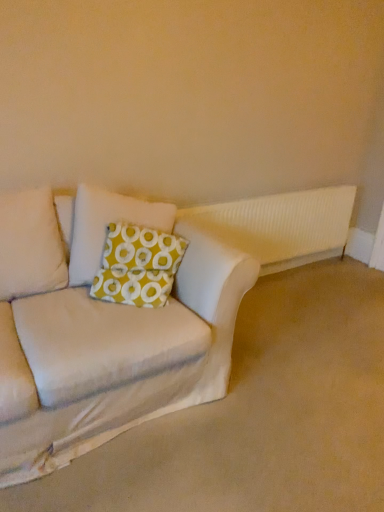
Identify the location of white ribbed radiator at upper right. (281, 225).

The height and width of the screenshot is (512, 384). What do you see at coordinates (106, 226) in the screenshot?
I see `yellowpatterned fabricpillow at center` at bounding box center [106, 226].

Describe the element at coordinates (103, 331) in the screenshot. I see `beige fabric couch at lower left` at that location.

Find the location of a particular element. The height and width of the screenshot is (512, 384). white ribbed radiator at upper right is located at coordinates (281, 225).

Is white ribbed radiator at upper right directly adjacent to green fabric pillow at center?

No, white ribbed radiator at upper right is not in contact with green fabric pillow at center.

Is white ribbed radiator at upper right surrounding green fabric pillow at center?

No.

Could you tell me if white ribbed radiator at upper right is turned towards green fabric pillow at center?

No, white ribbed radiator at upper right does not turn towards green fabric pillow at center.

Considering the sizes of objects white ribbed radiator at upper right and beige fabric couch at lower left in the image provided, who is shorter, white ribbed radiator at upper right or beige fabric couch at lower left?

With less height is beige fabric couch at lower left.

Is white ribbed radiator at upper right wider than beige fabric couch at lower left?

No, white ribbed radiator at upper right is not wider than beige fabric couch at lower left.

From a real-world perspective, is white ribbed radiator at upper right above or below beige fabric couch at lower left?

white ribbed radiator at upper right is above beige fabric couch at lower left.

Is white ribbed radiator at upper right facing away from beige fabric couch at lower left?

No, white ribbed radiator at upper right is not facing away from beige fabric couch at lower left.

Is the position of beige fabric couch at lower left more distant than that of white ribbed radiator at upper right?

No, it is in front of white ribbed radiator at upper right.

Could you tell me if beige fabric couch at lower left is turned towards white ribbed radiator at upper right?

No, beige fabric couch at lower left is not oriented towards white ribbed radiator at upper right.

From a real-world perspective, which object stands above the other?

white ribbed radiator at upper right is physically above.

Does beige fabric couch at lower left touch white ribbed radiator at upper right?

No, beige fabric couch at lower left is not beside white ribbed radiator at upper right.

Does green fabric pillow at center have a larger size compared to white ribbed radiator at upper right?

Actually, green fabric pillow at center might be smaller than white ribbed radiator at upper right.

Considering the sizes of green fabric pillow at center and white ribbed radiator at upper right in the image, is green fabric pillow at center taller or shorter than white ribbed radiator at upper right?

Considering their sizes, green fabric pillow at center has less height than white ribbed radiator at upper right.

From a real-world perspective, is green fabric pillow at center above or below white ribbed radiator at upper right?

In terms of real-world spatial position, green fabric pillow at center is above white ribbed radiator at upper right.

The height and width of the screenshot is (512, 384). In order to click on throw pillow located in front of the white ribbed radiator at upper right in this screenshot , I will do `click(138, 266)`.

Based on the photo, between yellowpatterned fabricpillow at center and white ribbed radiator at upper right, which one has larger width?

Wider between the two is yellowpatterned fabricpillow at center.

Which of these two, yellowpatterned fabricpillow at center or white ribbed radiator at upper right, is smaller?

white ribbed radiator at upper right is smaller.

In the scene shown: From the image's perspective, who appears lower, yellowpatterned fabricpillow at center or white ribbed radiator at upper right?

From the image's view, yellowpatterned fabricpillow at center is below.

Between point (75, 300) and point (169, 216), which one is positioned behind?

The point (169, 216) is farther from the camera.

How many degrees apart are the facing directions of beige fabric couch at lower left and yellowpatterned fabricpillow at center?

The angle between the facing direction of beige fabric couch at lower left and the facing direction of yellowpatterned fabricpillow at center is 98.7 degrees.

Is beige fabric couch at lower left positioned far away from yellowpatterned fabricpillow at center?

No, there isn't a large distance between beige fabric couch at lower left and yellowpatterned fabricpillow at center.

Does yellowpatterned fabricpillow at center turn towards green fabric pillow at center?

Yes, yellowpatterned fabricpillow at center is facing green fabric pillow at center.

Considering the sizes of objects yellowpatterned fabricpillow at center and green fabric pillow at center in the image provided, who is thinner, yellowpatterned fabricpillow at center or green fabric pillow at center?

With smaller width is green fabric pillow at center.

Relative to green fabric pillow at center, is yellowpatterned fabricpillow at center in front or behind?

yellowpatterned fabricpillow at center is positioned farther from the viewer than green fabric pillow at center.

Where is `throw pillow that appears on the right of yellowpatterned fabricpillow at center`? This screenshot has width=384, height=512. throw pillow that appears on the right of yellowpatterned fabricpillow at center is located at coordinates (138, 266).

This screenshot has height=512, width=384. Identify the location of radiator beneath the green fabric pillow at center (from a real-world perspective). (281, 225).

Find the location of a particular element. Image resolution: width=384 pixels, height=512 pixels. radiator on the right of beige fabric couch at lower left is located at coordinates (281, 225).

Which object lies nearer to the anchor point beige fabric couch at lower left, yellowpatterned fabricpillow at center or green fabric pillow at center?

The object closer to beige fabric couch at lower left is green fabric pillow at center.

Looking at the image, which one is located further to white ribbed radiator at upper right, beige fabric couch at lower left or green fabric pillow at center?

beige fabric couch at lower left lies further to white ribbed radiator at upper right than the other object.

Which object lies nearer to the anchor point yellowpatterned fabricpillow at center, beige fabric couch at lower left or green fabric pillow at center?

green fabric pillow at center lies closer to yellowpatterned fabricpillow at center than the other object.

Considering their positions, is yellowpatterned fabricpillow at center positioned further to white ribbed radiator at upper right than green fabric pillow at center?

green fabric pillow at center.

Looking at the image, which one is located closer to beige fabric couch at lower left, green fabric pillow at center or white ribbed radiator at upper right?

green fabric pillow at center lies closer to beige fabric couch at lower left than the other object.

Considering their positions, is beige fabric couch at lower left positioned further to yellowpatterned fabricpillow at center than white ribbed radiator at upper right?

white ribbed radiator at upper right.

Which object lies further to the anchor point green fabric pillow at center, white ribbed radiator at upper right or beige fabric couch at lower left?

white ribbed radiator at upper right lies further to green fabric pillow at center than the other object.

Looking at the image, which one is located closer to green fabric pillow at center, beige fabric couch at lower left or yellowpatterned fabricpillow at center?

Among the two, yellowpatterned fabricpillow at center is located nearer to green fabric pillow at center.

You are a GUI agent. You are given a task and a screenshot of the screen. Output one action in this format:
    pyautogui.click(x=<x>, y=<y>)
    Task: Click on the pillow between beige fabric couch at lower left and white ribbed radiator at upper right along the z-axis
    Image resolution: width=384 pixels, height=512 pixels.
    Given the screenshot: What is the action you would take?
    pyautogui.click(x=106, y=226)

The image size is (384, 512). Find the location of `throw pillow between yellowpatterned fabricpillow at center and beige fabric couch at lower left in the horizontal direction`. throw pillow between yellowpatterned fabricpillow at center and beige fabric couch at lower left in the horizontal direction is located at coordinates (138, 266).

At what (x,y) coordinates should I click in order to perform the action: click on throw pillow between yellowpatterned fabricpillow at center and white ribbed radiator at upper right from left to right. Please return your answer as a coordinate pair (x, y). The width and height of the screenshot is (384, 512). Looking at the image, I should click on (138, 266).

At what (x,y) coordinates should I click in order to perform the action: click on throw pillow positioned between beige fabric couch at lower left and white ribbed radiator at upper right from near to far. Please return your answer as a coordinate pair (x, y). This screenshot has height=512, width=384. Looking at the image, I should click on (138, 266).